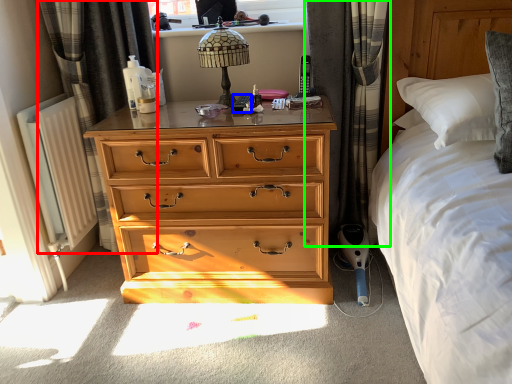
Question: Which object is the closest to the curtain (highlighted by a red box)? Choose among these: remote control (highlighted by a blue box) or curtain (highlighted by a green box).

Choices:
 (A) remote control
 (B) curtain

Answer: (A)